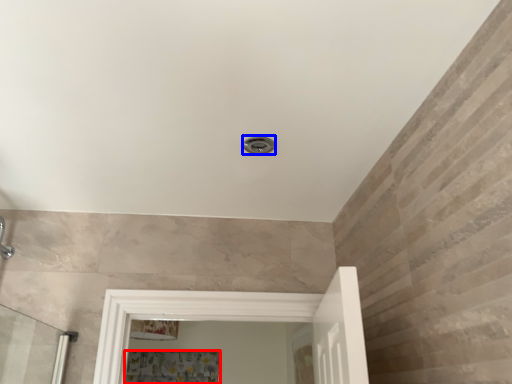
Question: Among these objects, which one is farthest to the camera, shower curtain (highlighted by a red box) or shower (highlighted by a blue box)?

Choices:
 (A) shower curtain
 (B) shower

Answer: (A)